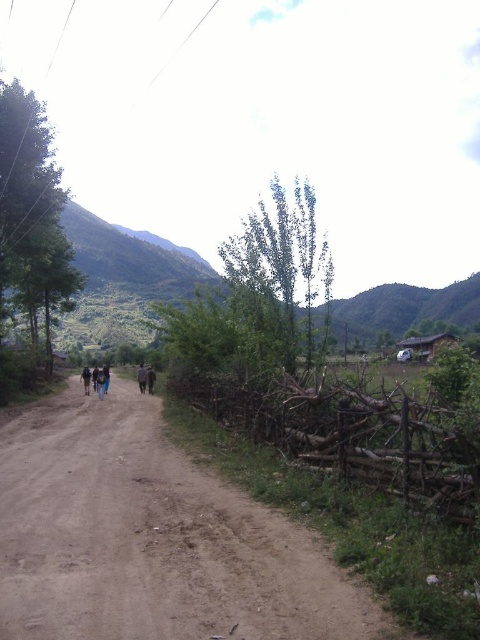
Can you confirm if dark blue jeans at center is positioned below dark brown leather jacket at center?

Actually, dark blue jeans at center is above dark brown leather jacket at center.

How much distance is there between dark blue jeans at center and dark brown leather jacket at center?

dark blue jeans at center is 43.73 meters from dark brown leather jacket at center.

Which is in front, point (143, 381) or point (83, 381)?

Positioned in front is point (143, 381).

Find the location of `dark blue jeans at center`. dark blue jeans at center is located at coordinates (142, 378).

Which is above, green grassy mountain at upper left or dark blue jeans at center?

Positioned higher is green grassy mountain at upper left.

Does green grassy mountain at upper left lie behind dark blue jeans at center?

Yes, green grassy mountain at upper left is behind dark blue jeans at center.

Is point (78, 308) closer to viewer compared to point (141, 392)?

No, it is not.

The width and height of the screenshot is (480, 640). What are the coordinates of `green grassy mountain at upper left` in the screenshot? It's located at (122, 278).

Between brown dirt track at center and dark blue jeans at center, which one appears on the left side from the viewer's perspective?

From the viewer's perspective, dark blue jeans at center appears more on the left side.

Where is `brown dirt track at center`? The image size is (480, 640). brown dirt track at center is located at coordinates pos(152,538).

The height and width of the screenshot is (640, 480). Find the location of `brown dirt track at center`. brown dirt track at center is located at coordinates (152, 538).